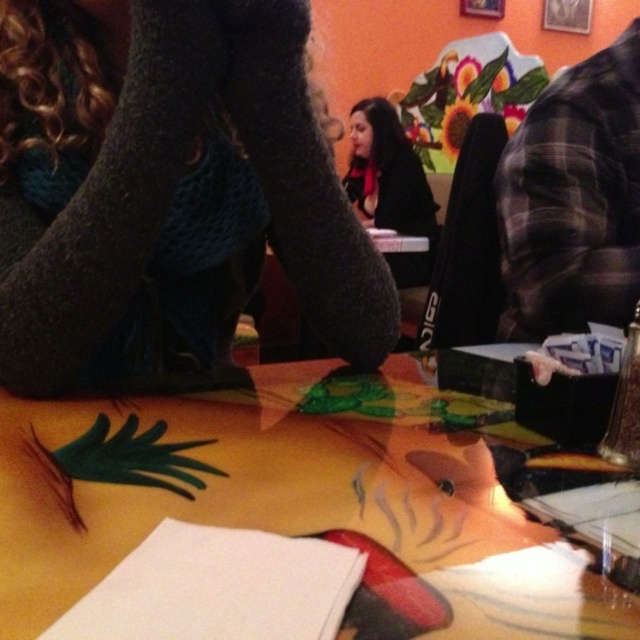
What is the exact location of the knitted dark gray socks at lower left on the table?

The knitted dark gray socks at lower left are located at point (168, 195) on the table.

You are a photographer trying to capture the knitted dark gray socks at lower left in the image. Based on their position, can you estimate whether they are closer to the edge of the table or near the center?

The knitted dark gray socks at lower left is located at point (168,195), which places them closer to the edge of the table rather than the center.

You are a person sitting at the table in the image. You want to place your phone on the table so that it is as close as possible to your left knee. The coordinates of your left knee are given as point (x=168, y=195). Where should you place your phone on the table to achieve this?

You should place your phone on the knitted dark gray socks at lower left, which is where the point (x=168, y=195) is located, to be as close as possible to your left knee.